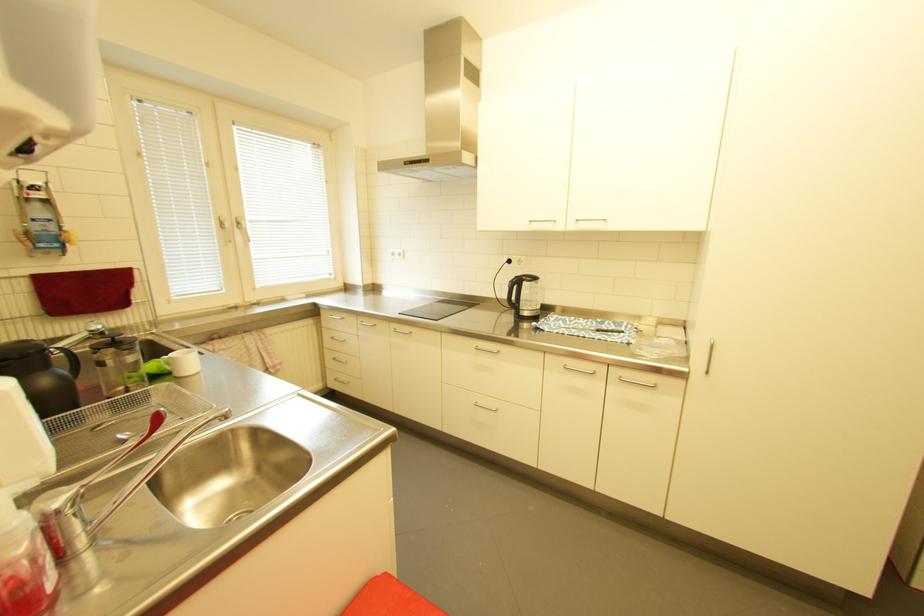
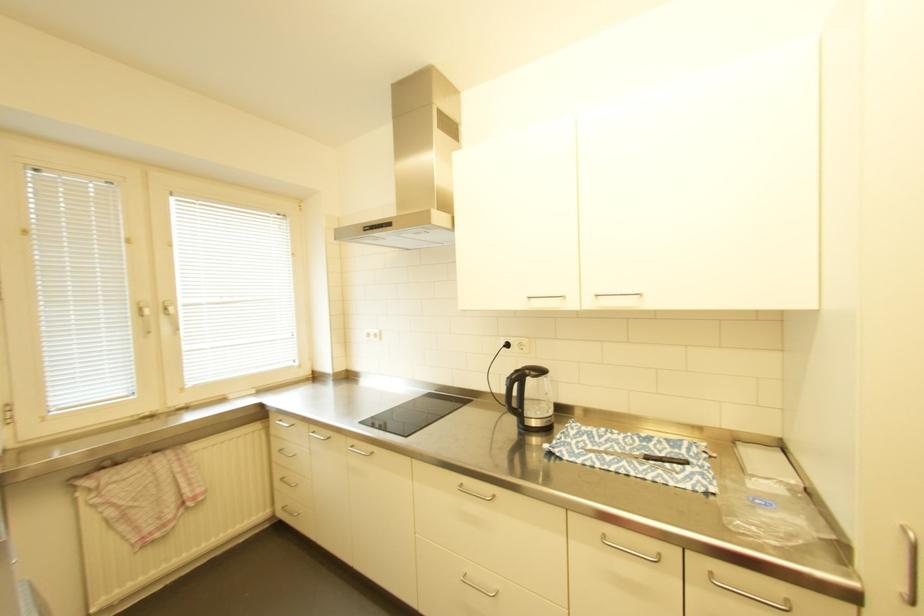
In the second image, find the point that corresponds to point (245, 231) in the first image.

(171, 318)